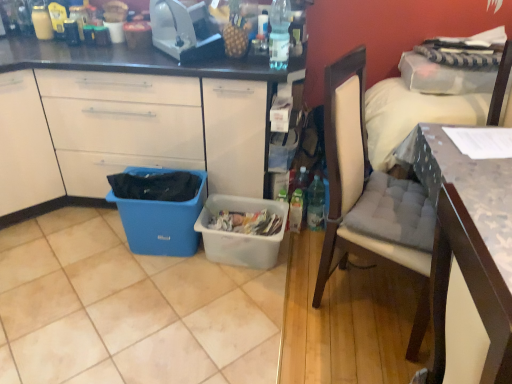
Question: From a real-world perspective, is white matte cabinet at left located higher than wooden textured desk at right?

Choices:
 (A) no
 (B) yes

Answer: (B)

Question: Is wooden textured desk at right a part of white matte cabinet at left?

Choices:
 (A) no
 (B) yes

Answer: (A)

Question: From a real-world perspective, is white matte cabinet at left beneath wooden textured desk at right?

Choices:
 (A) yes
 (B) no

Answer: (B)

Question: Considering the relative positions of white matte cabinet at left and wooden textured desk at right in the image provided, is white matte cabinet at left to the right of wooden textured desk at right from the viewer's perspective?

Choices:
 (A) no
 (B) yes

Answer: (A)

Question: Is white matte cabinet at left turned away from wooden textured desk at right?

Choices:
 (A) no
 (B) yes

Answer: (A)

Question: Is the surface of white matte cabinet at left in direct contact with wooden textured desk at right?

Choices:
 (A) yes
 (B) no

Answer: (B)

Question: Is blue plastic bin at lower left placed right next to light beige fabric chair at right?

Choices:
 (A) yes
 (B) no

Answer: (B)

Question: Considering the relative sizes of blue plastic bin at lower left and light beige fabric chair at right in the image provided, is blue plastic bin at lower left taller than light beige fabric chair at right?

Choices:
 (A) no
 (B) yes

Answer: (A)

Question: Is blue plastic bin at lower left positioned beyond the bounds of light beige fabric chair at right?

Choices:
 (A) yes
 (B) no

Answer: (A)

Question: Can you confirm if blue plastic bin at lower left is smaller than light beige fabric chair at right?

Choices:
 (A) yes
 (B) no

Answer: (A)

Question: Is blue plastic bin at lower left positioned far away from light beige fabric chair at right?

Choices:
 (A) no
 (B) yes

Answer: (B)

Question: Does blue plastic bin at lower left turn towards light beige fabric chair at right?

Choices:
 (A) no
 (B) yes

Answer: (A)

Question: Does clear plastic bottle at upper center turn towards white fabric pillow at upper right?

Choices:
 (A) no
 (B) yes

Answer: (A)